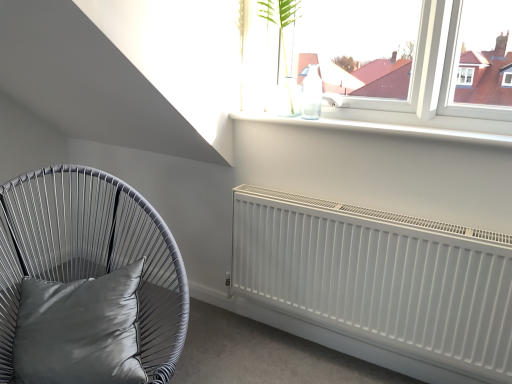
This screenshot has height=384, width=512. What do you see at coordinates (79, 330) in the screenshot?
I see `satin gray pillow at lower left` at bounding box center [79, 330].

Image resolution: width=512 pixels, height=384 pixels. Identify the location of satin gray pillow at lower left. (79, 330).

Describe the element at coordinates (92, 254) in the screenshot. This screenshot has height=384, width=512. I see `satin grey cushion at left` at that location.

This screenshot has height=384, width=512. Describe the element at coordinates (380, 281) in the screenshot. I see `white matte radiator at lower right` at that location.

Measure the distance between point (506, 281) and camera.

4.55 feet.

Where is `satin gray pillow at lower left`? This screenshot has width=512, height=384. satin gray pillow at lower left is located at coordinates (79, 330).

Is translucent glass vase at upper center at the back of satin grey cushion at left?

satin grey cushion at left is not turned away from translucent glass vase at upper center.

Is satin grey cushion at left next to translucent glass vase at upper center and touching it?

No.

Does satin grey cushion at left come in front of translucent glass vase at upper center?

Yes, satin grey cushion at left is closer to the camera.

Is satin grey cushion at left inside the boundaries of translucent glass vase at upper center, or outside?

satin grey cushion at left is not inside translucent glass vase at upper center, it's outside.

Is the position of white matte radiator at lower right less distant than that of translucent glass vase at upper center?

Yes, it is.

Which of these two, white matte radiator at lower right or translucent glass vase at upper center, is bigger?

Bigger between the two is white matte radiator at lower right.

From the image's perspective, between white matte radiator at lower right and translucent glass vase at upper center, who is located below?

white matte radiator at lower right, from the image's perspective.

Would you consider white matte radiator at lower right to be distant from translucent glass vase at upper center?

Actually, white matte radiator at lower right and translucent glass vase at upper center are a little close together.

Based on the photo, measure the distance between satin grey cushion at left and satin gray pillow at lower left.

They are 4.99 inches apart.

Which of these two, satin grey cushion at left or satin gray pillow at lower left, is thinner?

With smaller width is satin gray pillow at lower left.

From a real-world perspective, is satin grey cushion at left beneath satin gray pillow at lower left?

Yes, from a real-world perspective, satin grey cushion at left is under satin gray pillow at lower left.

Considering the positions of objects satin grey cushion at left and satin gray pillow at lower left in the image provided, who is in front, satin grey cushion at left or satin gray pillow at lower left?

satin grey cushion at left is more forward.

Is satin grey cushion at left closer to camera compared to white matte radiator at lower right?

Yes, the depth of satin grey cushion at left is less than that of white matte radiator at lower right.

Based on the photo, who is shorter, satin grey cushion at left or white matte radiator at lower right?

With less height is white matte radiator at lower right.

From the image's perspective, would you say satin grey cushion at left is shown under white matte radiator at lower right?

Yes.

Locate an element on the screen. This screenshot has width=512, height=384. radiator that is on the right side of satin grey cushion at left is located at coordinates (380, 281).

Looking at the image, does white matte radiator at lower right seem bigger or smaller compared to satin grey cushion at left?

In the image, white matte radiator at lower right appears to be smaller than satin grey cushion at left.

Considering the relative sizes of white matte radiator at lower right and satin grey cushion at left in the image provided, is white matte radiator at lower right shorter than satin grey cushion at left?

Yes, white matte radiator at lower right is shorter than satin grey cushion at left.

Is white matte radiator at lower right facing away from satin grey cushion at left?

No, white matte radiator at lower right is not facing the opposite direction of satin grey cushion at left.

The height and width of the screenshot is (384, 512). What are the coordinates of `radiator below the translucent glass vase at upper center (from the image's perspective)` in the screenshot? It's located at click(x=380, y=281).

Considering the positions of objects translucent glass vase at upper center and white matte radiator at lower right in the image provided, who is more to the right, translucent glass vase at upper center or white matte radiator at lower right?

From the viewer's perspective, white matte radiator at lower right appears more on the right side.

Is white matte radiator at lower right at the back of translucent glass vase at upper center?

No, white matte radiator at lower right is not at the back of translucent glass vase at upper center.

Looking at this image, from a real-world perspective, is translucent glass vase at upper center positioned above or below satin gray pillow at lower left?

translucent glass vase at upper center is situated higher than satin gray pillow at lower left in the real world.

Considering the relative sizes of translucent glass vase at upper center and satin gray pillow at lower left in the image provided, is translucent glass vase at upper center wider than satin gray pillow at lower left?

Incorrect, the width of translucent glass vase at upper center does not surpass that of satin gray pillow at lower left.

Consider the image. How far apart are translucent glass vase at upper center and satin gray pillow at lower left?

They are 1.20 meters apart.

Between translucent glass vase at upper center and satin gray pillow at lower left, which one is positioned in front?

satin gray pillow at lower left is more forward.

Find the location of a particular element. The height and width of the screenshot is (384, 512). plant that appears above the satin grey cushion at left (from a real-world perspective) is located at coordinates (279, 16).

Identify the location of plant above the white matte radiator at lower right (from the image's perspective). (279, 16).

Based on the photo, based on their spatial positions, is translucent glass vase at upper center or satin gray pillow at lower left closer to white matte radiator at lower right?

The object closer to white matte radiator at lower right is translucent glass vase at upper center.

Looking at the image, which one is located closer to satin grey cushion at left, white matte radiator at lower right or satin gray pillow at lower left?

satin gray pillow at lower left.

Estimate the real-world distances between objects in this image. Which object is closer to white matte radiator at lower right, satin grey cushion at left or translucent glass vase at upper center?

Based on the image, satin grey cushion at left appears to be nearer to white matte radiator at lower right.

Which object lies further to the anchor point translucent glass vase at upper center, satin grey cushion at left or satin gray pillow at lower left?

satin gray pillow at lower left.

Considering their positions, is satin grey cushion at left positioned further to satin gray pillow at lower left than translucent glass vase at upper center?

Among the two, translucent glass vase at upper center is located further to satin gray pillow at lower left.

When comparing their distances from satin gray pillow at lower left, does translucent glass vase at upper center or satin grey cushion at left seem further?

Among the two, translucent glass vase at upper center is located further to satin gray pillow at lower left.

When comparing their distances from translucent glass vase at upper center, does white matte radiator at lower right or satin grey cushion at left seem further?

satin grey cushion at left lies further to translucent glass vase at upper center than the other object.

Looking at the image, which one is located further to satin gray pillow at lower left, white matte radiator at lower right or translucent glass vase at upper center?

Among the two, translucent glass vase at upper center is located further to satin gray pillow at lower left.

Locate an element on the screen. The width and height of the screenshot is (512, 384). pillow between satin grey cushion at left and white matte radiator at lower right from left to right is located at coordinates (79, 330).

You are a GUI agent. You are given a task and a screenshot of the screen. Output one action in this format:
    pyautogui.click(x=<x>, y=<y>)
    Task: Click on the pillow between translucent glass vase at upper center and satin grey cushion at left from top to bottom
    
    Given the screenshot: What is the action you would take?
    pyautogui.click(x=79, y=330)

The height and width of the screenshot is (384, 512). In order to click on radiator between translucent glass vase at upper center and satin grey cushion at left from top to bottom in this screenshot , I will do `click(380, 281)`.

Identify the location of radiator that lies between translucent glass vase at upper center and satin gray pillow at lower left from top to bottom. This screenshot has height=384, width=512. (380, 281).